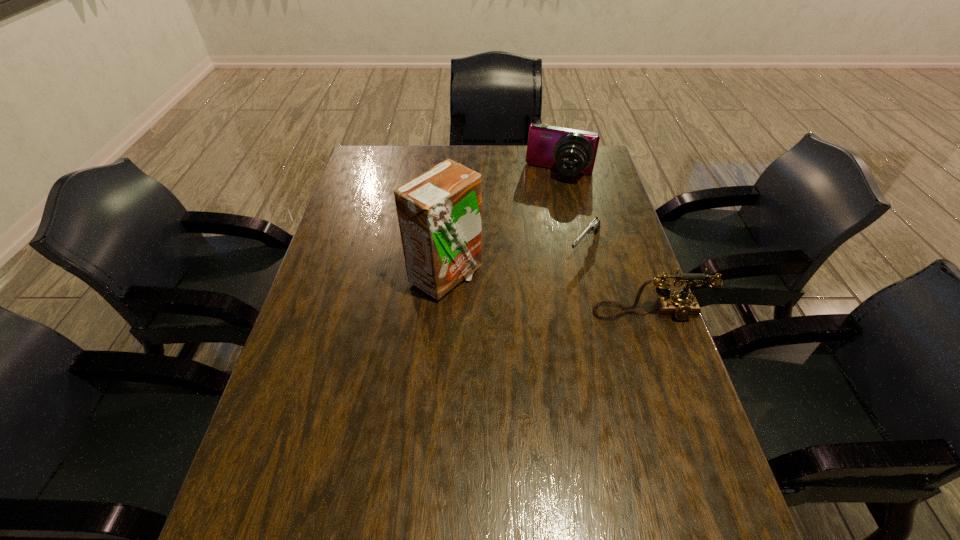
Find the location of a particular element. This screenshot has height=540, width=960. object that is at the far right corner is located at coordinates (571, 151).

The image size is (960, 540). In the image, there is a desktop. In order to click on vacant space at the far edge in this screenshot , I will do `click(528, 178)`.

In the image, there is a desktop. In order to click on vacant space at the near edge in this screenshot , I will do `click(600, 475)`.

Where is `vacant space at the left edge`? This screenshot has width=960, height=540. vacant space at the left edge is located at coordinates pyautogui.click(x=380, y=201).

The image size is (960, 540). In the image, there is a desktop. In order to click on vacant space at the right edge in this screenshot , I will do `click(633, 381)`.

At what (x,y) coordinates should I click in order to perform the action: click on empty space between the telephone and the farthest object. Please return your answer as a coordinate pair (x, y). Looking at the image, I should click on (605, 244).

Image resolution: width=960 pixels, height=540 pixels. I want to click on vacant area that lies between the telephone and the pistol, so click(x=617, y=279).

Find the location of a particular element. The image size is (960, 540). free space between the fourth nearest object and the telephone is located at coordinates (542, 258).

Locate an element on the screen. This screenshot has height=540, width=960. empty space that is in between the telephone and the shortest object is located at coordinates (617, 279).

The width and height of the screenshot is (960, 540). In order to click on free point between the camera and the pinecone in this screenshot , I will do `click(496, 188)`.